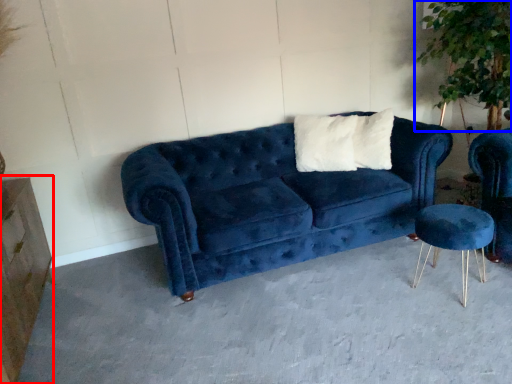
Question: Which of the following is the closest to the observer, dresser (highlighted by a red box) or plant (highlighted by a blue box)?

Choices:
 (A) dresser
 (B) plant

Answer: (A)